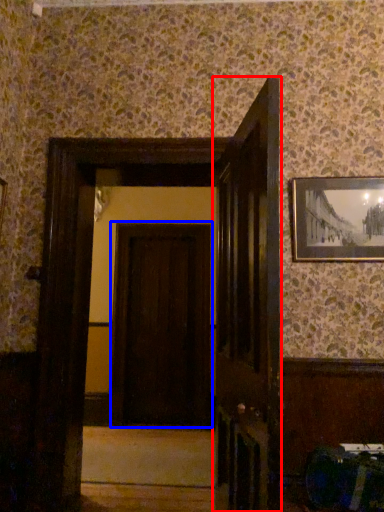
Question: Which object is further to the camera taking this photo, door (highlighted by a red box) or door (highlighted by a blue box)?

Choices:
 (A) door
 (B) door

Answer: (B)